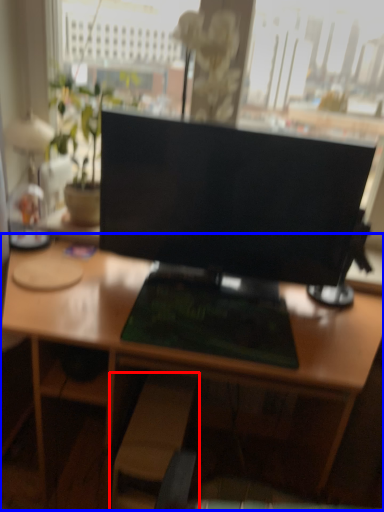
Question: Which object is further to the camera taking this photo, swivel chair (highlighted by a red box) or desk (highlighted by a blue box)?

Choices:
 (A) swivel chair
 (B) desk

Answer: (A)